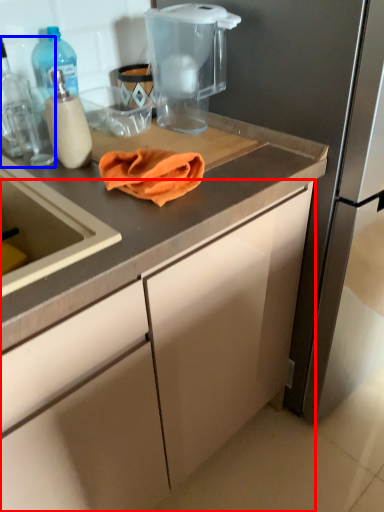
Question: Which object appears closest to the camera in this image, cabinetry (highlighted by a red box) or kitchen appliance (highlighted by a blue box)?

Choices:
 (A) cabinetry
 (B) kitchen appliance

Answer: (A)